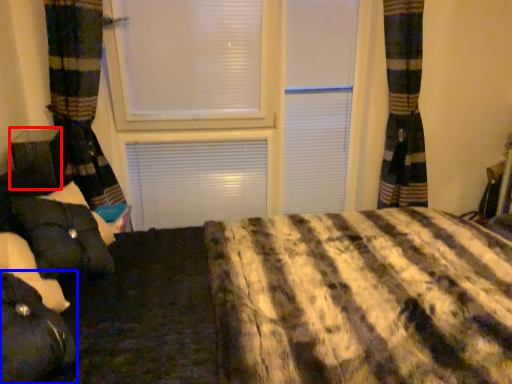
Question: Which point is further to the camera, furniture (highlighted by a red box) or bean bag chair (highlighted by a blue box)?

Choices:
 (A) furniture
 (B) bean bag chair

Answer: (A)